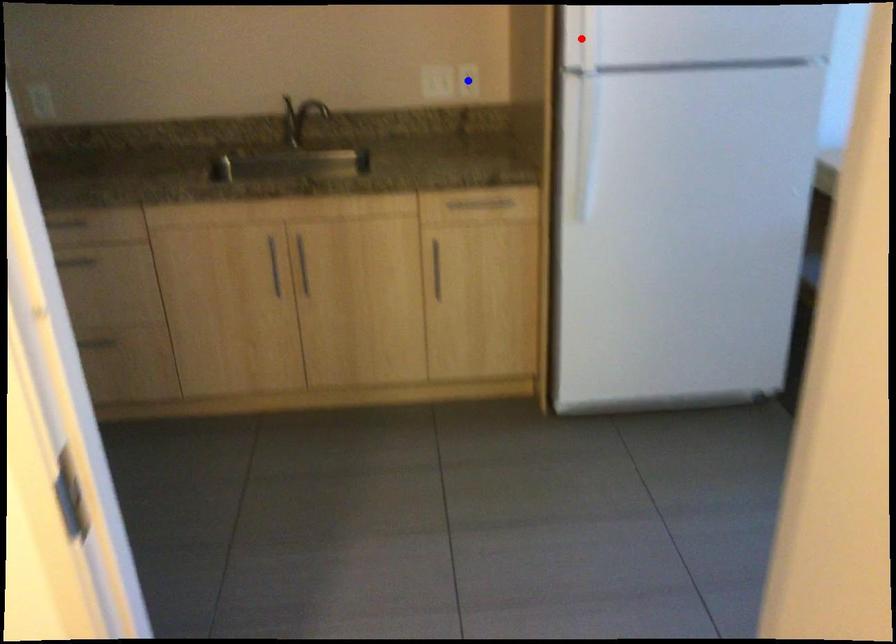
Question: Two points are marked on the image. Which point is closer to the camera?

Choices:
 (A) Blue point is closer.
 (B) Red point is closer.

Answer: (B)